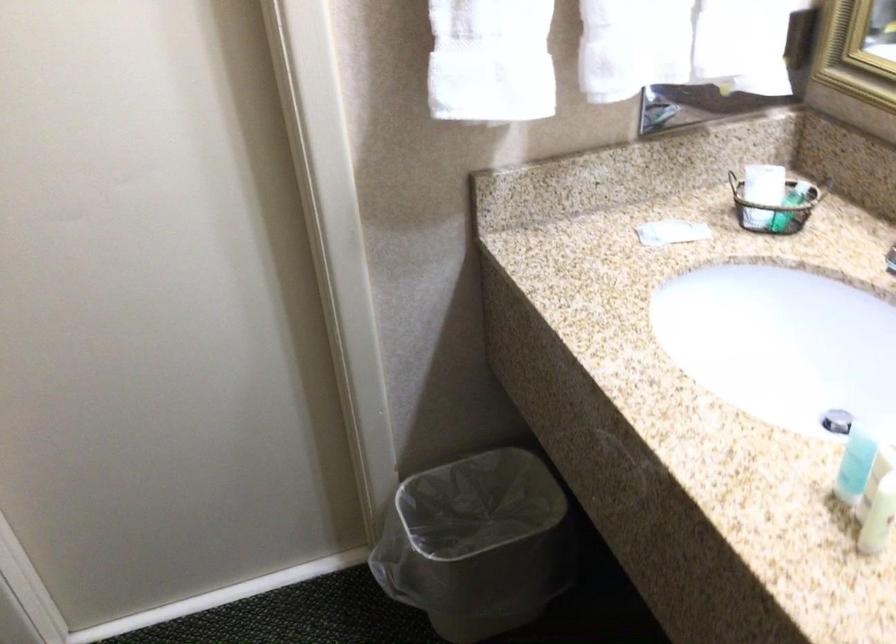
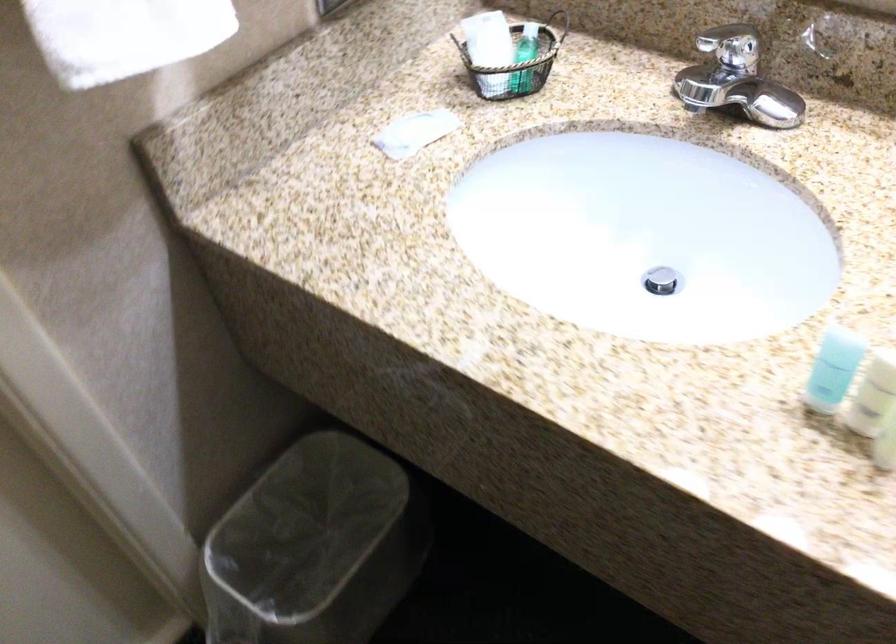
The point at [474,96] is marked in the first image. Where is the corresponding point in the second image?

(124, 35)